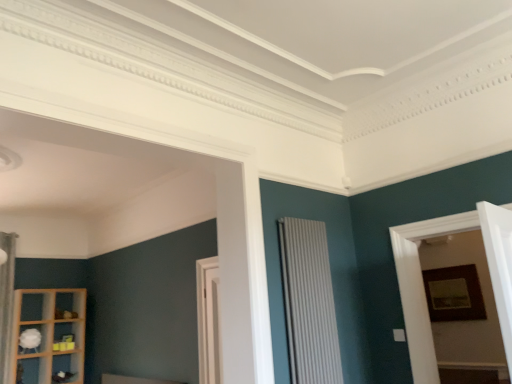
Question: Is white fabric curtain at left far from wooden shelf at lower left, the second shelf when ordered from top to bottom?

Choices:
 (A) no
 (B) yes

Answer: (A)

Question: Considering the relative sizes of white fabric curtain at left and wooden shelf at lower left, the second shelf when ordered from top to bottom, in the image provided, is white fabric curtain at left wider than wooden shelf at lower left, the second shelf when ordered from top to bottom,?

Choices:
 (A) no
 (B) yes

Answer: (A)

Question: From a real-world perspective, is white fabric curtain at left physically above wooden shelf at lower left, the first shelf when ordered from bottom to top?

Choices:
 (A) no
 (B) yes

Answer: (B)

Question: Is white fabric curtain at left taller than wooden shelf at lower left, the second shelf when ordered from top to bottom?

Choices:
 (A) no
 (B) yes

Answer: (B)

Question: From the image's perspective, is white fabric curtain at left beneath wooden shelf at lower left, the first shelf when ordered from bottom to top?

Choices:
 (A) no
 (B) yes

Answer: (A)

Question: From the image's perspective, is white matte shelf at lower left, which appears as the first shelf when viewed from the top, positioned above or below wooden picture frame at right?

Choices:
 (A) below
 (B) above

Answer: (A)

Question: Considering the relative positions of white matte shelf at lower left, acting as the second shelf starting from the bottom, and wooden picture frame at right in the image provided, is white matte shelf at lower left, acting as the second shelf starting from the bottom, to the left or to the right of wooden picture frame at right?

Choices:
 (A) left
 (B) right

Answer: (A)

Question: Does point 37,342 appear closer or farther from the camera than point 452,269?

Choices:
 (A) closer
 (B) farther

Answer: (B)

Question: Considering the positions of white matte shelf at lower left, which appears as the first shelf when viewed from the top, and wooden picture frame at right in the image, is white matte shelf at lower left, which appears as the first shelf when viewed from the top, bigger or smaller than wooden picture frame at right?

Choices:
 (A) big
 (B) small

Answer: (B)

Question: From their relative heights in the image, would you say white fabric curtain at left is taller or shorter than wooden picture frame at right?

Choices:
 (A) tall
 (B) short

Answer: (A)

Question: Looking at the image, does white fabric curtain at left seem bigger or smaller compared to wooden picture frame at right?

Choices:
 (A) small
 (B) big

Answer: (B)

Question: Based on their positions, is white fabric curtain at left located to the left or right of wooden picture frame at right?

Choices:
 (A) left
 (B) right

Answer: (A)

Question: From a real-world perspective, is white fabric curtain at left physically located above or below wooden picture frame at right?

Choices:
 (A) below
 (B) above

Answer: (B)

Question: Is wooden framed picture at right taller or shorter than wooden shelf at lower left, the first shelf when ordered from bottom to top?

Choices:
 (A) short
 (B) tall

Answer: (A)

Question: Is point (418, 377) closer or farther from the camera than point (17, 327)?

Choices:
 (A) farther
 (B) closer

Answer: (B)